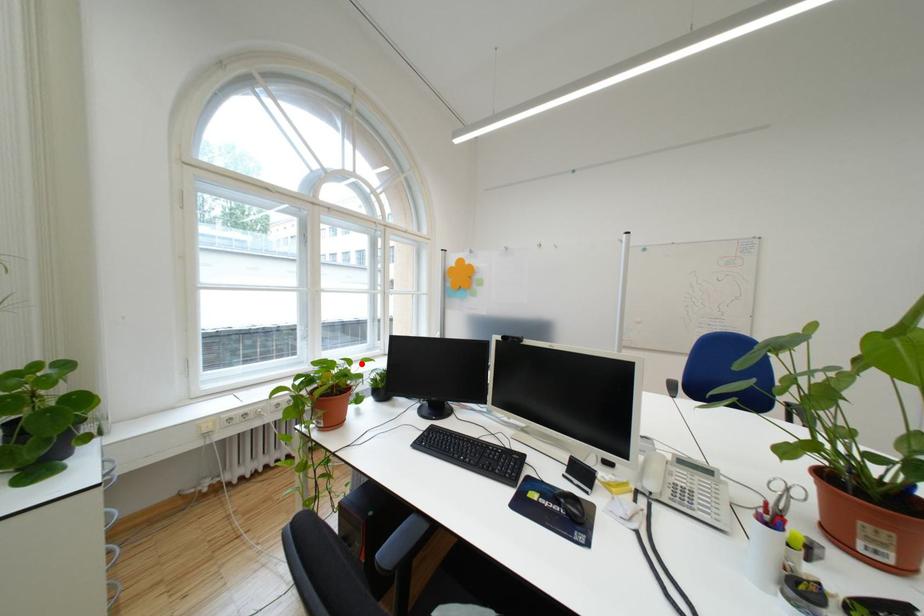
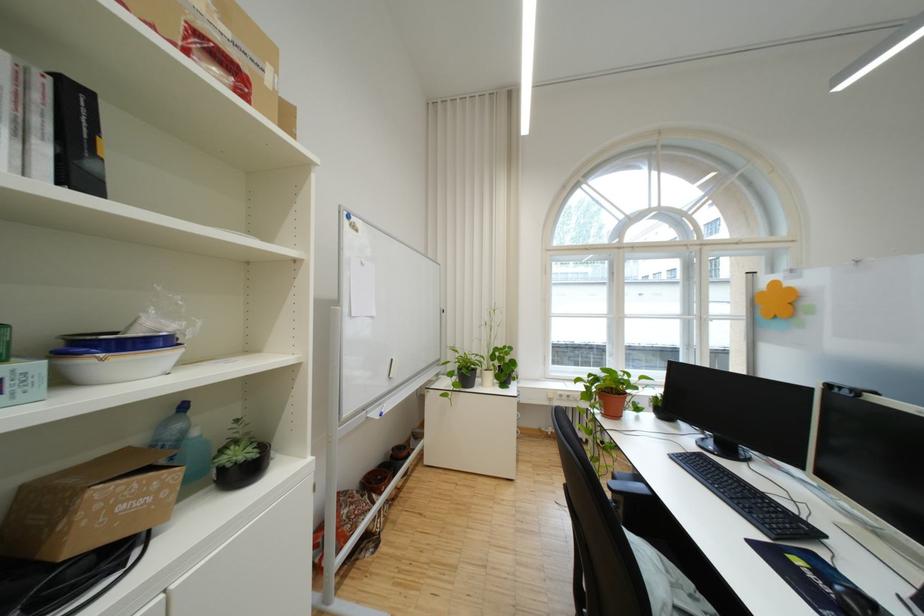
Where in the second image is the point corresponding to the highlighted location from the first image?

(640, 377)